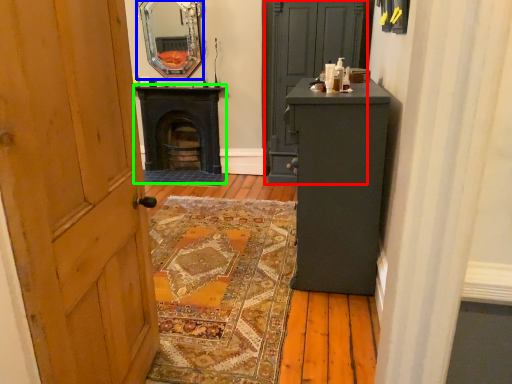
Question: Which is nearer to the door (highlighted by a red box)? mirror (highlighted by a blue box) or stove (highlighted by a green box).

Choices:
 (A) mirror
 (B) stove

Answer: (B)